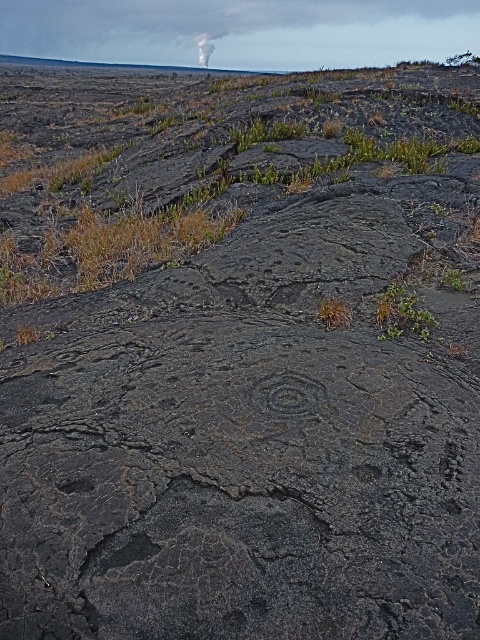
Does green leafy plant at center have a larger size compared to white smoke at upper center?

No, green leafy plant at center is not bigger than white smoke at upper center.

Which is in front, point (402, 301) or point (197, 61)?

Positioned in front is point (402, 301).

Between point (423, 324) and point (204, 52), which one is positioned in front?

Positioned in front is point (423, 324).

Where is `green leafy plant at center`? green leafy plant at center is located at coordinates (402, 314).

Can you confirm if black textured rock at center is bigger than white smoke at upper center?

Incorrect, black textured rock at center is not larger than white smoke at upper center.

Is black textured rock at center behind white smoke at upper center?

No, it is in front of white smoke at upper center.

Identify the location of black textured rock at center. 288,394.

Identify the location of black textured rock at center. (288, 394).

Is black textured rock at center thinner than green leafy plant at center?

Yes.

Is black textured rock at center smaller than green leafy plant at center?

Yes, black textured rock at center is smaller than green leafy plant at center.

Is point (283, 412) closer to viewer compared to point (376, 310)?

Yes, point (283, 412) is closer to viewer.

The width and height of the screenshot is (480, 640). I want to click on black textured rock at center, so click(x=288, y=394).